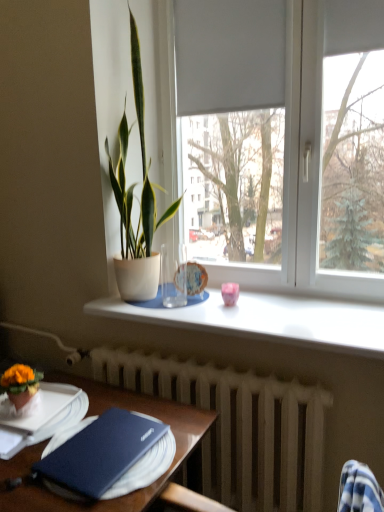
At what (x,y) coordinates should I click in order to perform the action: click on vacant region in front of pink glossy cup at center, the second tableware from the left. Please return your answer as a coordinate pair (x, y). Looking at the image, I should click on (238, 318).